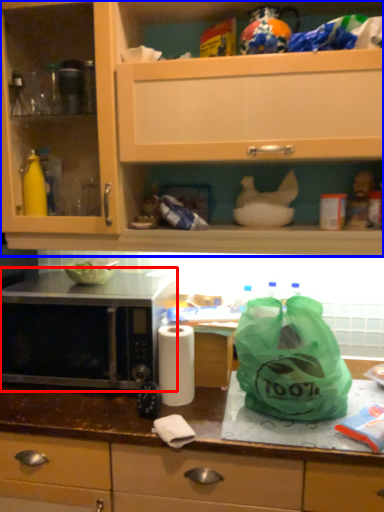
Question: Among these objects, which one is farthest to the camera, microwave oven (highlighted by a red box) or cabinetry (highlighted by a blue box)?

Choices:
 (A) microwave oven
 (B) cabinetry

Answer: (A)